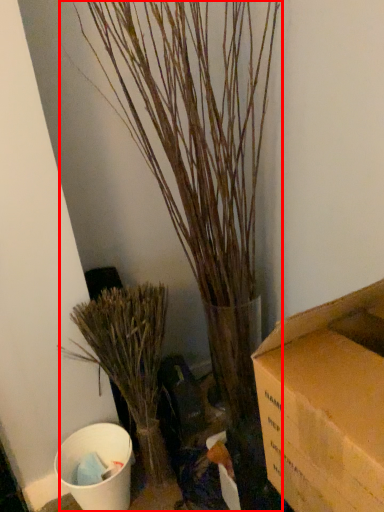
Question: From the image's perspective, considering the relative positions of houseplant (annotated by the red box) and houseplant in the image provided, where is houseplant (annotated by the red box) located with respect to the staircase?

Choices:
 (A) above
 (B) below

Answer: (A)